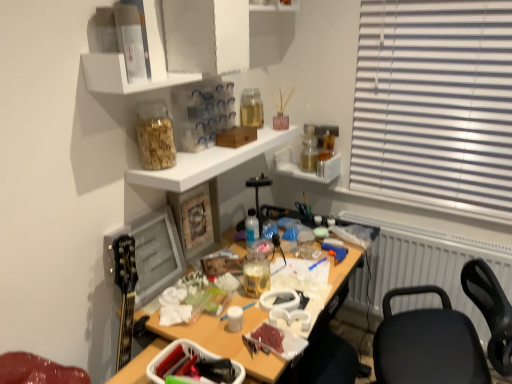
This screenshot has height=384, width=512. Find the location of `empty space that is ontop of translucent glass jars at upper right, arranged as the 4th shelf when viewed from the top (from a real-world perspective)`. empty space that is ontop of translucent glass jars at upper right, arranged as the 4th shelf when viewed from the top (from a real-world perspective) is located at coordinates (306, 148).